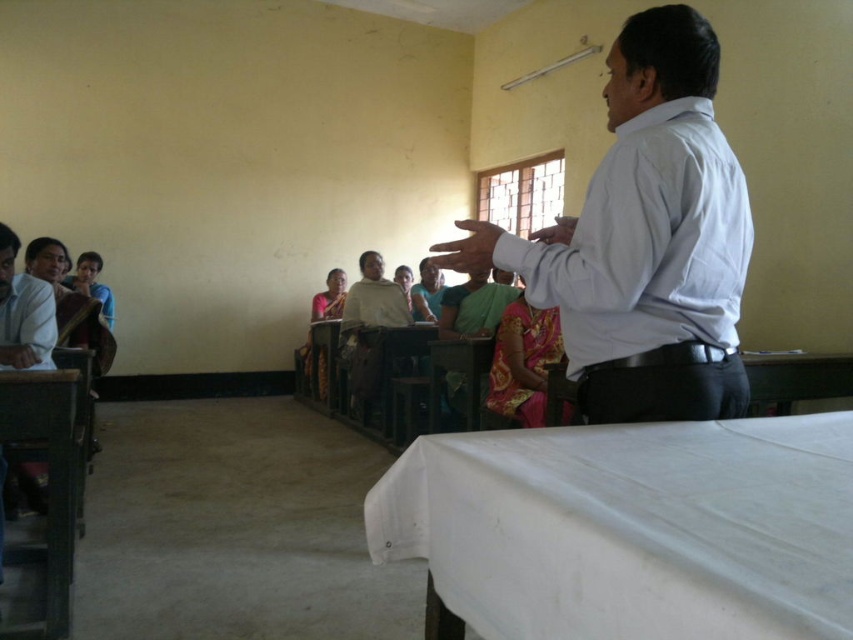
In the classroom scene, there is a white shirt at upper right and a wooden table at lower left. Which object occupies more horizontal space in the image?

The white shirt at upper right occupies more horizontal space than the wooden table at lower left because its width is larger.

You are standing in the classroom and want to take a photo of the two points marked in the scene. Which point, point [656,275] or point [49,438], will appear larger in your camera view?

Point [656,275] will appear larger in the camera view because it is closer to the camera than point [49,438].

You are standing at the entrance of the classroom and want to approach the white fabric table at lower right. Which direction should you move relative to your current position?

Since the white fabric table at lower right is located at point (631, 529), you should move towards the lower right direction from your current position at the entrance to reach it.